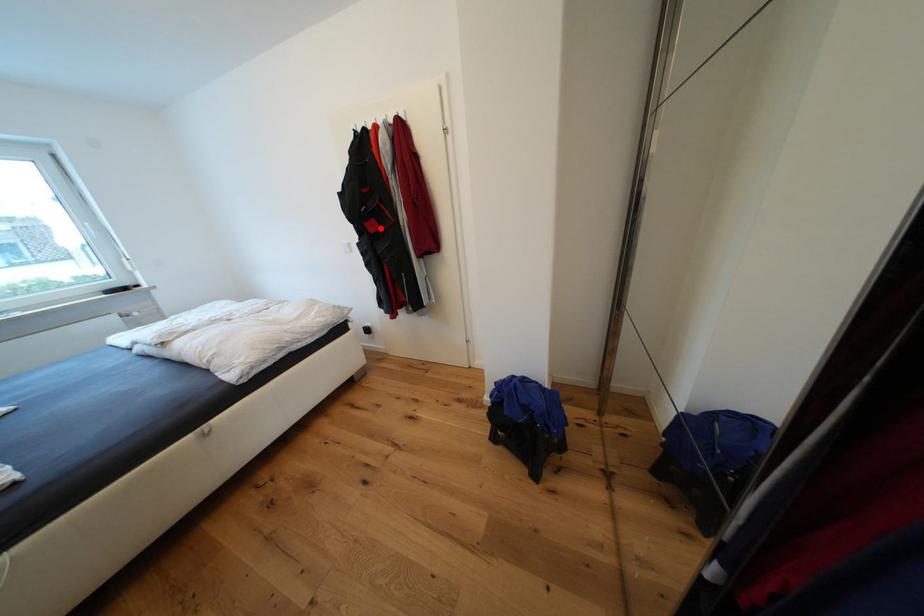
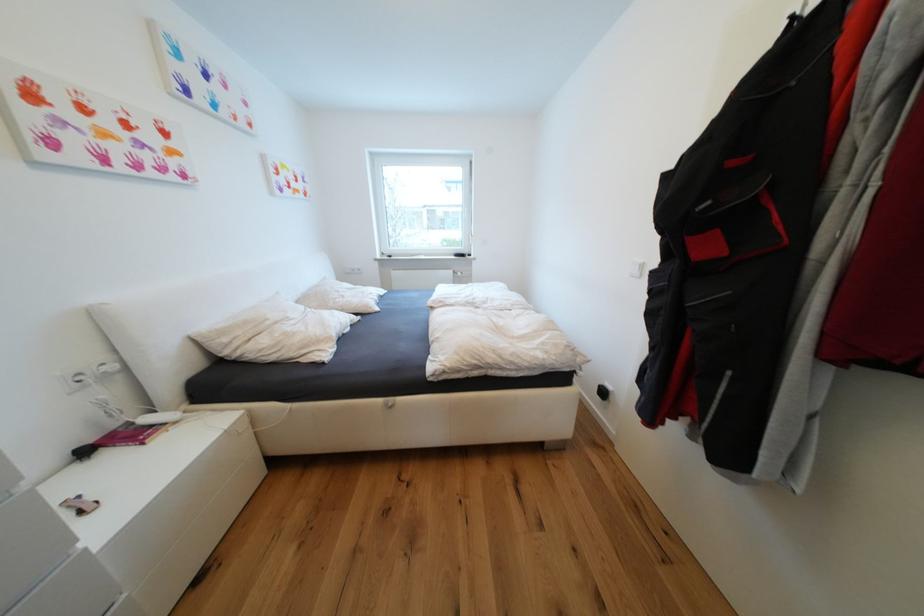
Locate, in the second image, the point that corresponds to the highlighted location in the first image.

(714, 249)